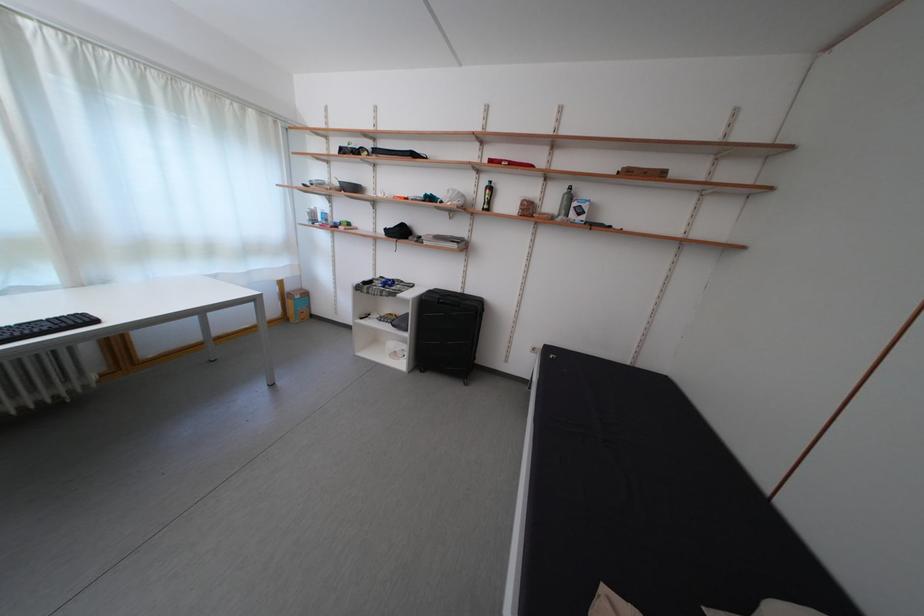
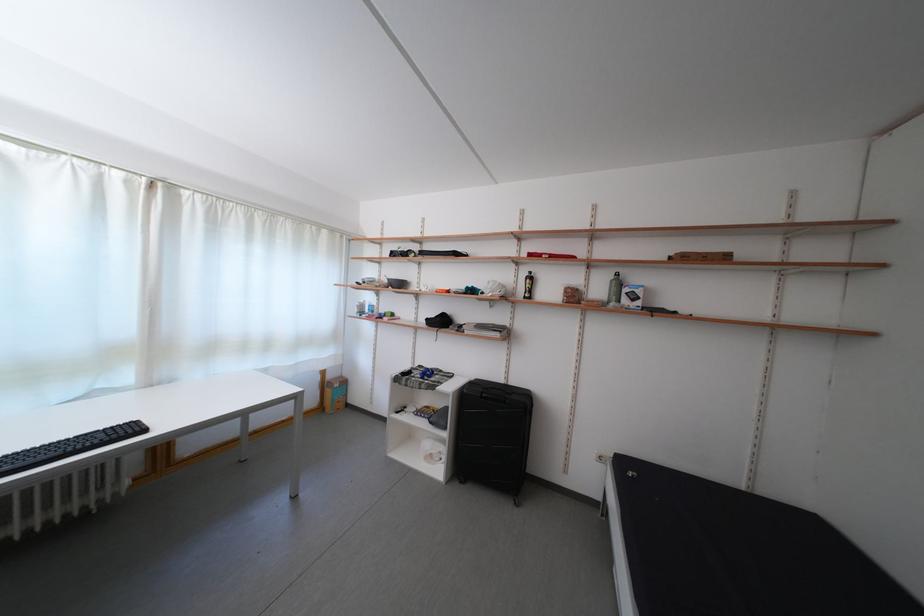
Question: How did the camera likely rotate?

Choices:
 (A) Left
 (B) Right
 (C) Up
 (D) Down

Answer: (C)